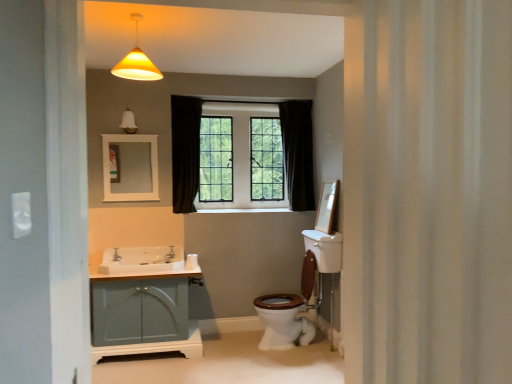
What are the coordinates of `vacant space in front of white matte toilet paper at lower center` in the screenshot? It's located at (182, 266).